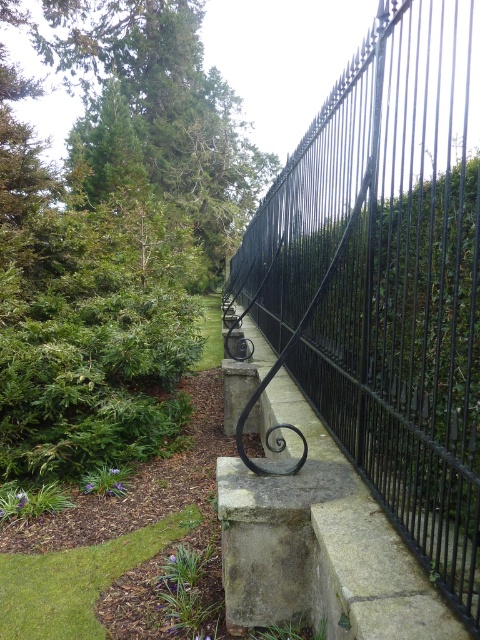
Is point (271, 227) in front of point (266, 493)?

No, (271, 227) is behind (266, 493).

Does black wrought iron fence at right come behind gray concrete at center?

No, it is not.

Who is more forward, [478,196] or [286,515]?

Point [478,196] is more forward.

You are a GUI agent. You are given a task and a screenshot of the screen. Output one action in this format:
    pyautogui.click(x=<x>, y=<y>)
    Task: Click on the black wrought iron fence at right
    The width and height of the screenshot is (480, 640).
    Given the screenshot: What is the action you would take?
    pyautogui.click(x=388, y=280)

Is green leafy tree at upper left wider than gray concrete at center?

Indeed, green leafy tree at upper left has a greater width compared to gray concrete at center.

Who is lower down, green leafy tree at upper left or gray concrete at center?

Positioned lower is gray concrete at center.

What do you see at coordinates (157, 113) in the screenshot?
I see `green leafy tree at upper left` at bounding box center [157, 113].

This screenshot has height=640, width=480. Find the location of `green leafy tree at upper left`. green leafy tree at upper left is located at coordinates (157, 113).

Can you confirm if black wrought iron fence at right is positioned to the right of green leafy tree at upper left?

Yes, black wrought iron fence at right is to the right of green leafy tree at upper left.

Can you confirm if black wrought iron fence at right is positioned above green leafy tree at upper left?

No.

This screenshot has width=480, height=640. Find the location of `black wrought iron fence at right`. black wrought iron fence at right is located at coordinates (388, 280).

Find the location of a particular element. black wrought iron fence at right is located at coordinates (388, 280).